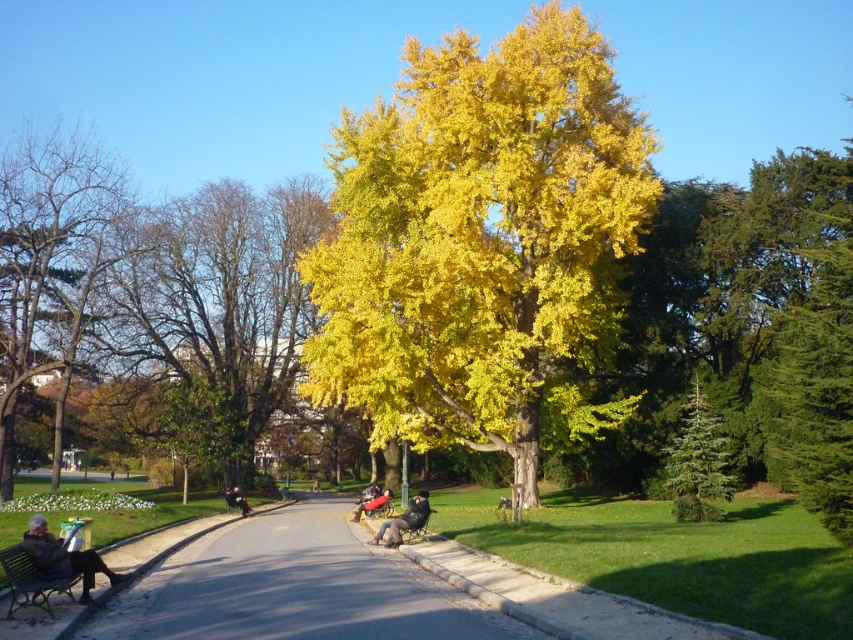
You are standing at the point marked by the coordinates point (477, 236) in the park. Looking around, you see the golden leafy tree at center. Which direction should you walk to reach the benches where people are sitting on the left side of the pathway?

The golden leafy tree at center is located at the point marked by the coordinates point (477, 236). Since the benches are on the left side of the pathway, you should walk towards the left side of the pathway to reach them.

Consider the image. You are a photographer planning to take a picture of the bare wood tree at left and the leather jacket at center in the park scene. Based on their sizes, which object should you focus on first if you want to ensure both are in sharp focus?

The bare wood tree at left is taller than the leather jacket at center, so you should focus on the bare wood tree at left first to ensure both are in sharp focus since it is larger and requires more precise focusing.